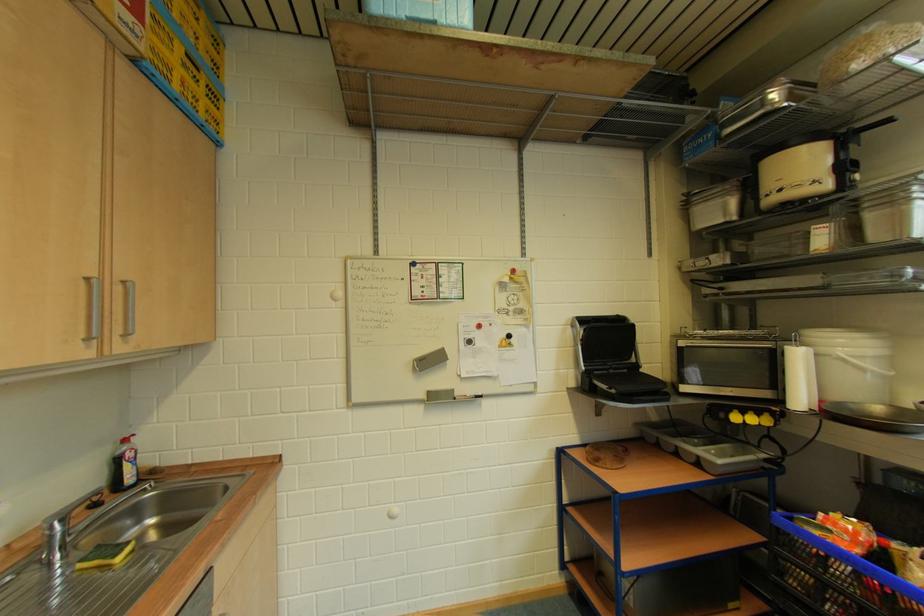
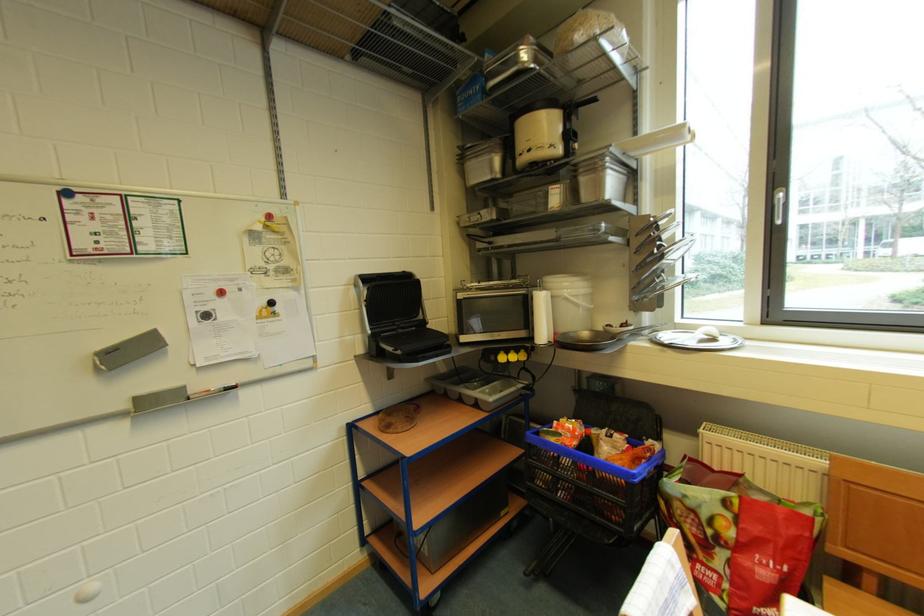
The point at (872, 208) is marked in the first image. Where is the corresponding point in the second image?

(589, 174)